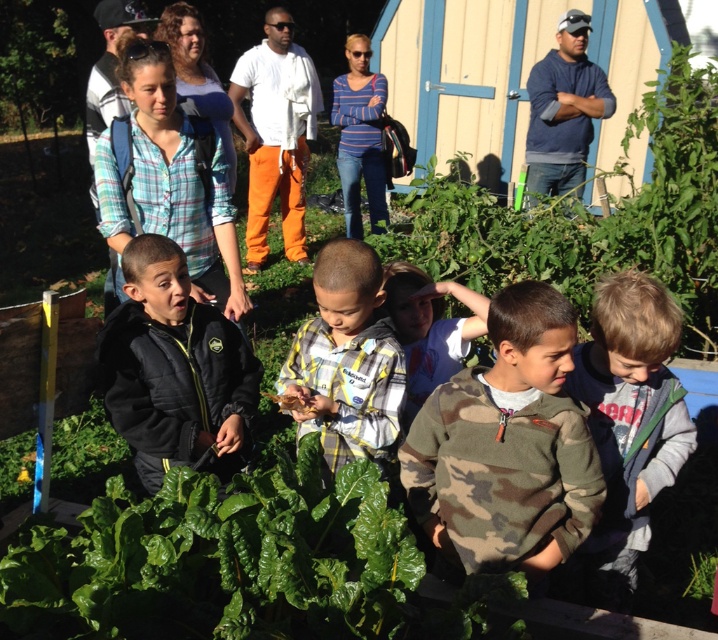
Question: Does blue fleece jacket at upper right have a greater width compared to camouflage shirt at center?

Choices:
 (A) no
 (B) yes

Answer: (B)

Question: Which of these objects is positioned farthest from the blue plaid shirt at upper left?

Choices:
 (A) green leafy vegetable at center
 (B) striped cotton shirt at center
 (C) camouflage sweater at center

Answer: (B)

Question: Can you confirm if green leafy vegetable at center is positioned below striped cotton shirt at center?

Choices:
 (A) no
 (B) yes

Answer: (B)

Question: Estimate the real-world distances between objects in this image. Which object is closer to the white cotton shirt at center?

Choices:
 (A) gray fleece jacket at lower right
 (B) striped cotton shirt at center
 (C) blue plaid shirt at upper left
 (D) camouflage sweater at center

Answer: (B)

Question: Does green leafy vegetable at center appear under black quilted jacket at center?

Choices:
 (A) yes
 (B) no

Answer: (A)

Question: Considering the real-world distances, which object is closest to the green leafy vegetable at center?

Choices:
 (A) gray fleece jacket at lower right
 (B) white cotton shirt at center

Answer: (A)